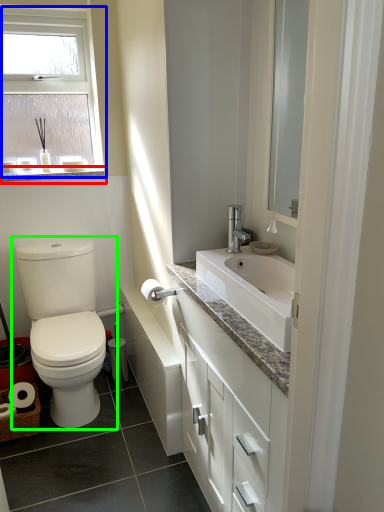
Question: Which object is the farthest from window sill (highlighted by a red box)? Choose among these: window (highlighted by a blue box) or toilet (highlighted by a green box).

Choices:
 (A) window
 (B) toilet

Answer: (B)